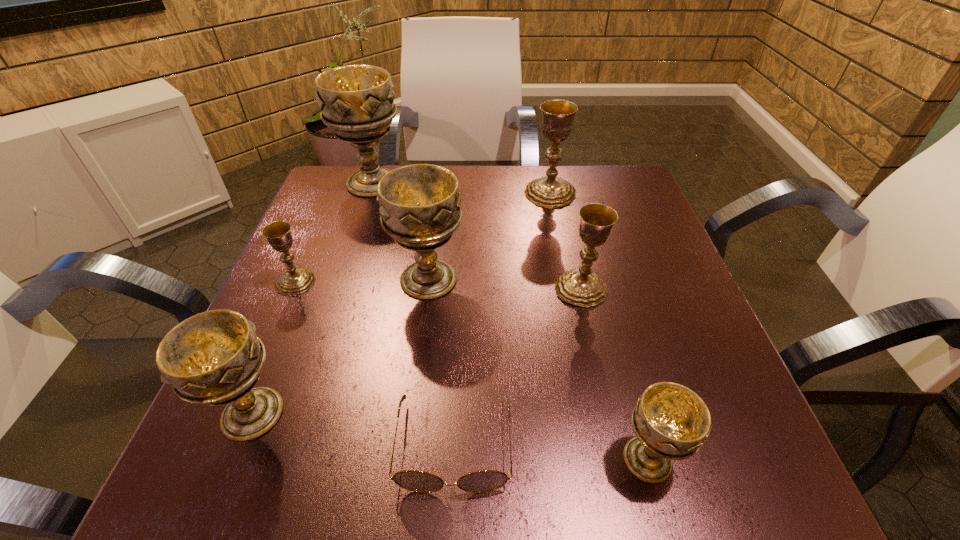
You are a GUI agent. You are given a task and a screenshot of the screen. Output one action in this format:
    pyautogui.click(x=<x>, y=<y>)
    Task: Click on the object that is at the near left corner
    The image size is (960, 540).
    Given the screenshot: What is the action you would take?
    pyautogui.click(x=214, y=358)

Identify the location of object located in the near right corner section of the desktop. (671, 421).

In the image, there is a desktop. Identify the location of blank space at the near edge. (359, 465).

At what (x,y) coordinates should I click in order to perform the action: click on free space at the left edge of the desktop. Please return your answer as a coordinate pair (x, y). Looking at the image, I should click on (291, 251).

Where is `vacant space at the right edge`? vacant space at the right edge is located at coordinates (651, 237).

Locate an element on the screen. free spot at the far left corner of the desktop is located at coordinates (328, 198).

Identify the location of vacant space at the far right corner. (590, 192).

Where is `free spot between the third biggest white chalice and the tallest object`? The image size is (960, 540). free spot between the third biggest white chalice and the tallest object is located at coordinates (313, 298).

At what (x,y) coordinates should I click in order to perform the action: click on free space between the second farthest white chalice and the biggest gold chalice. Please return your answer as a coordinate pair (x, y). Image resolution: width=960 pixels, height=540 pixels. Looking at the image, I should click on (490, 237).

Locate an element on the screen. The image size is (960, 540). vacant area that lies between the leftmost gold chalice and the shortest object is located at coordinates (374, 363).